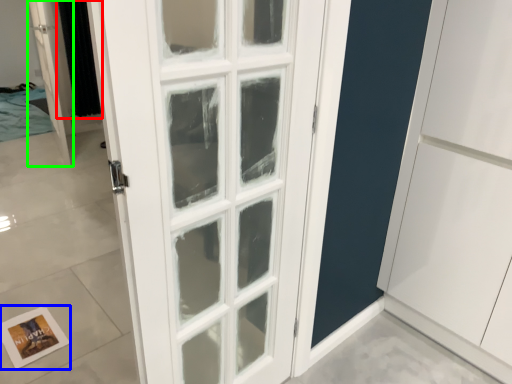
Question: Which object is the farthest from curtain (highlighted by a red box)? Choose among these: postcard (highlighted by a blue box) or door (highlighted by a green box).

Choices:
 (A) postcard
 (B) door

Answer: (A)